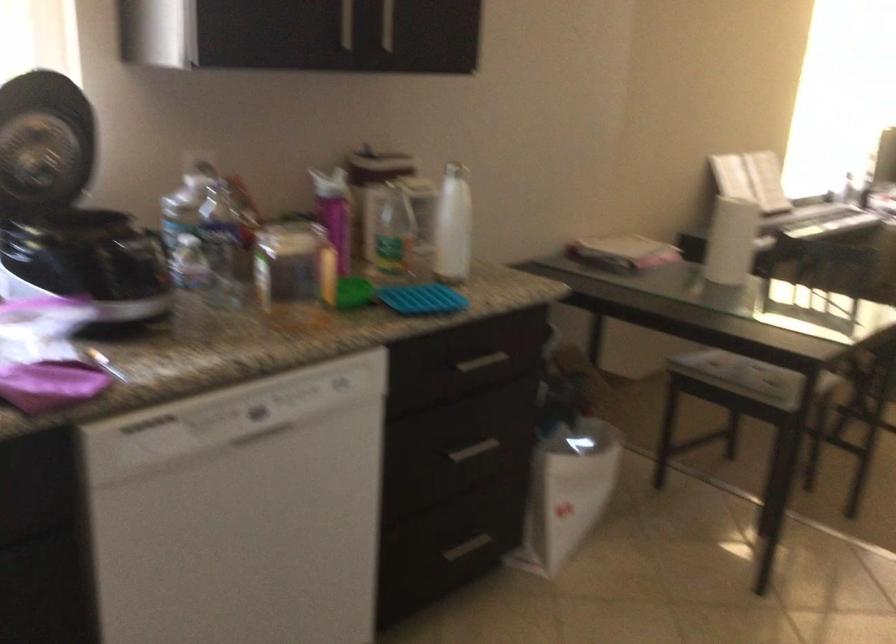
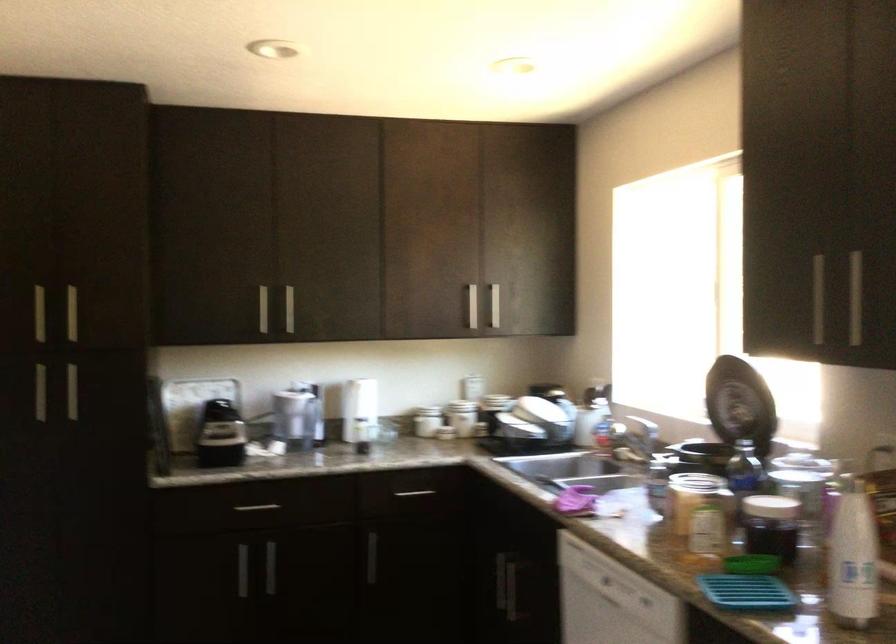
Locate, in the second image, the point that corresponds to point (207, 250) in the first image.

(771, 526)